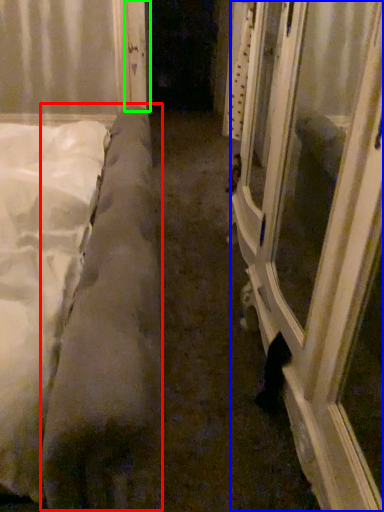
Question: Estimate the real-world distances between objects in this image. Which object is farther from mattress (highlighted by a red box), window frame (highlighted by a blue box) or door (highlighted by a green box)?

Choices:
 (A) window frame
 (B) door

Answer: (B)